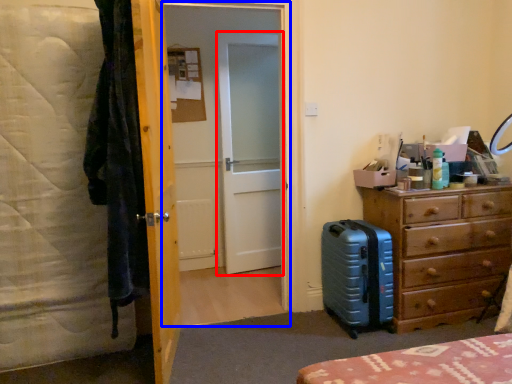
Question: Which point is closer to the camera, screen door (highlighted by a red box) or screen door (highlighted by a blue box)?

Choices:
 (A) screen door
 (B) screen door

Answer: (B)